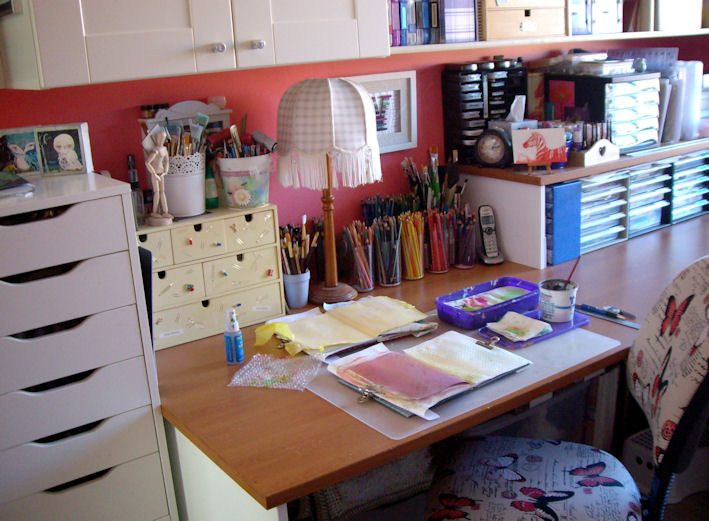
This screenshot has height=521, width=709. In order to click on lamp in this screenshot , I will do `click(352, 122)`.